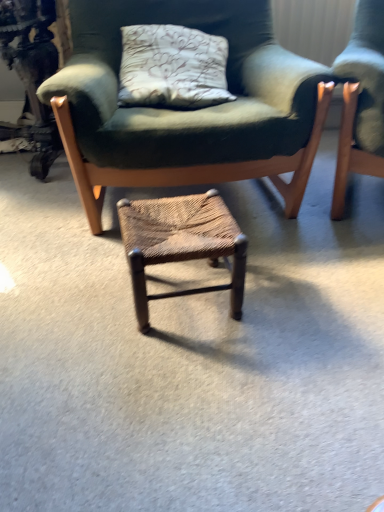
Question: Is green fabric chair at center taller than woven brown stool at center?

Choices:
 (A) no
 (B) yes

Answer: (B)

Question: Is green fabric chair at center next to woven brown stool at center and touching it?

Choices:
 (A) no
 (B) yes

Answer: (A)

Question: Is green fabric chair at center facing away from woven brown stool at center?

Choices:
 (A) yes
 (B) no

Answer: (B)

Question: Is green fabric chair at center thinner than woven brown stool at center?

Choices:
 (A) yes
 (B) no

Answer: (B)

Question: Is green fabric chair at center bigger than woven brown stool at center?

Choices:
 (A) yes
 (B) no

Answer: (A)

Question: Is woven brown stool at center located within green fabric chair at center?

Choices:
 (A) yes
 (B) no

Answer: (B)

Question: Is woven brown stool at center directly adjacent to green fabric chair at center?

Choices:
 (A) no
 (B) yes

Answer: (A)

Question: Considering the relative sizes of woven brown stool at center and green fabric chair at center in the image provided, is woven brown stool at center smaller than green fabric chair at center?

Choices:
 (A) yes
 (B) no

Answer: (A)

Question: Does woven brown stool at center have a lesser width compared to green fabric chair at center?

Choices:
 (A) yes
 (B) no

Answer: (A)

Question: From the image's perspective, does woven brown stool at center appear higher than green fabric chair at center?

Choices:
 (A) no
 (B) yes

Answer: (A)

Question: Could you tell me if woven brown stool at center is facing green fabric chair at center?

Choices:
 (A) no
 (B) yes

Answer: (A)

Question: Does woven brown stool at center lie in front of green fabric chair at center?

Choices:
 (A) no
 (B) yes

Answer: (B)

Question: From a real-world perspective, is green fabric chair at center physically located above or below woven brown stool at center?

Choices:
 (A) above
 (B) below

Answer: (A)